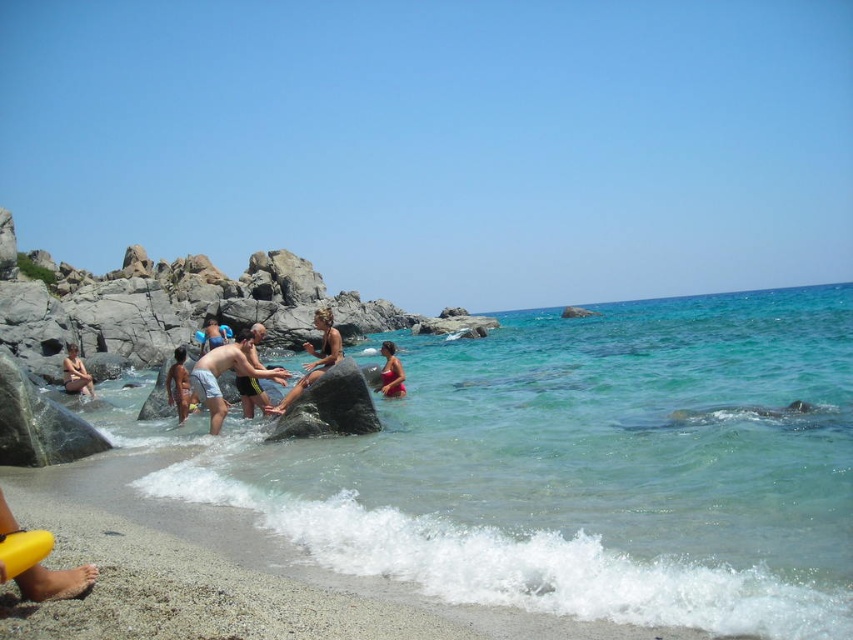
You are a photographer trying to capture a clear shot of the smooth skin person at center and the matte skin person at lower left. Which person will appear closer to the camera in the photo?

The smooth skin person at center will appear closer to the camera because they are positioned in front of the matte skin person at lower left.

You are a photographer trying to capture a photo of the yellow rubber at lower left and the matte pink swimsuit at lower center. Which object should you focus on first to ensure both are in sharp focus?

The yellow rubber at lower left is closer to the viewer than the matte pink swimsuit at lower center. To ensure both are in sharp focus, focus on the yellow rubber at lower left since it is closer, and the matte pink swimsuit at lower center will be in focus as well due to the depth of field.

Where is the smooth skin person at center located in the image?

The smooth skin person at center is located at the 2D coordinates point (315, 358).